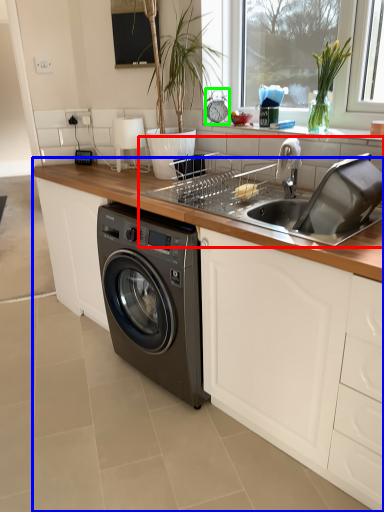
Question: Estimate the real-world distances between objects in this image. Which object is closer to sink (highlighted by a red box), countertop (highlighted by a blue box) or appliance (highlighted by a green box)?

Choices:
 (A) countertop
 (B) appliance

Answer: (A)